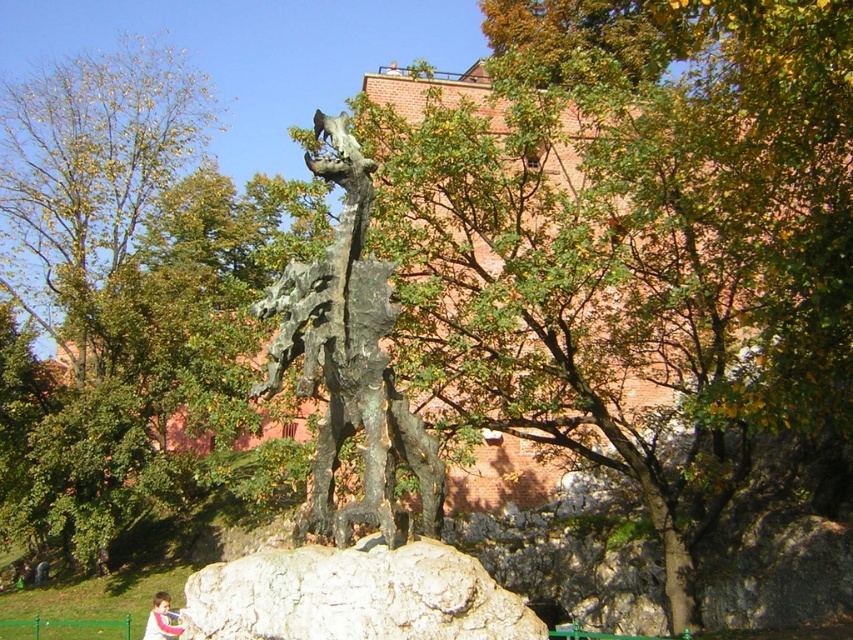
You are standing in front of the sculpture and want to walk from point A to point B. If point A is at coordinates point (291,332) and point B is at coordinates point (210,618), which direction should you move to reach point B from point A?

To move from point A at coordinates point (291,332) to point B at coordinates point (210,618), you should move forward since point A is behind point B.

You are an artist planning to sketch the sculpture in the park. To ensure accuracy, you need to know the exact location of the gray rough rock at center. What are its coordinates?

The gray rough rock at center is located at coordinates point (354, 595).

You are an artist planning to paint the sculpture in the park. You need to know the relative heights of the bronze textured dragon at center and the pink fabric at lower center to decide where to position your easel. Which object is taller?

The bronze textured dragon at center is not as tall as the pink fabric at lower center, so the pink fabric at lower center is taller.